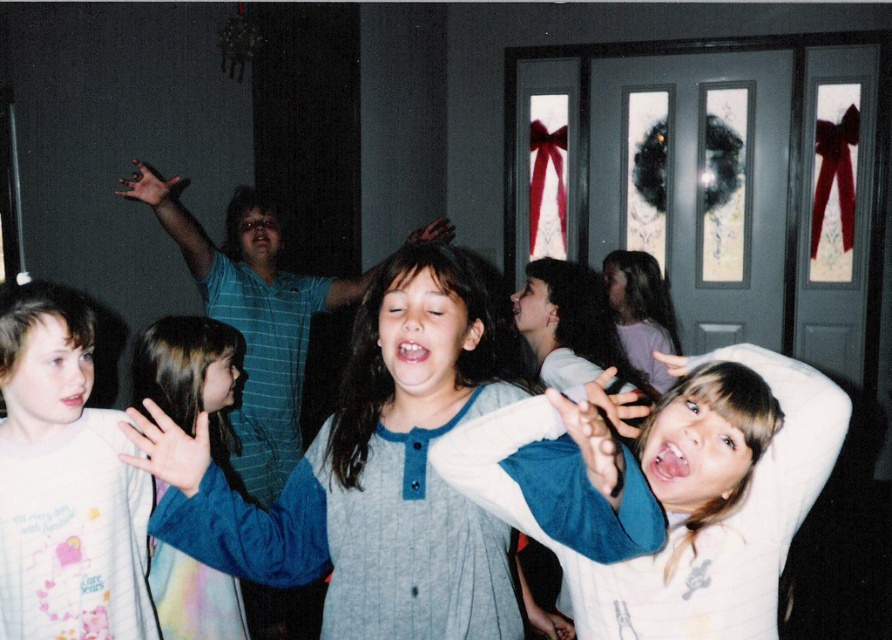
Question: From the image, what is the correct spatial relationship of blue striped pajamas at center in relation to blue fabric shirt at center?

Choices:
 (A) above
 (B) below

Answer: (A)

Question: Is blue striped pajamas at center below blue fabric shirt at center?

Choices:
 (A) no
 (B) yes

Answer: (A)

Question: Which point appears closest to the camera in this image?

Choices:
 (A) (411, 400)
 (B) (168, 321)

Answer: (A)

Question: Considering the relative positions of blue striped pajamas at center and blue fabric shirt at center in the image provided, where is blue striped pajamas at center located with respect to blue fabric shirt at center?

Choices:
 (A) above
 (B) below

Answer: (A)